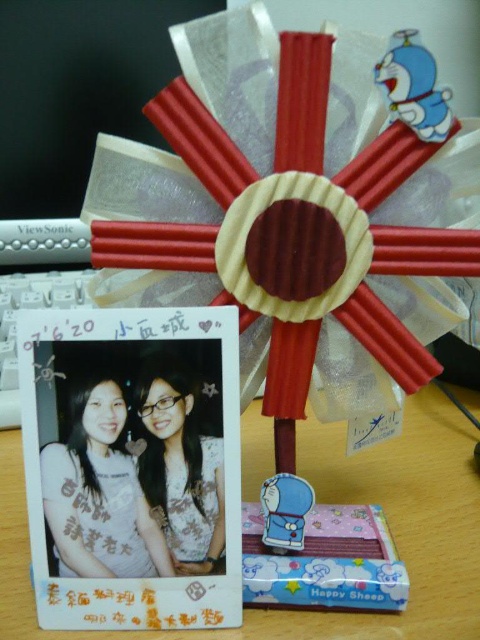
Question: Which point is closer to the camera taking this photo?

Choices:
 (A) (444, 496)
 (B) (123, 515)

Answer: (B)

Question: Does white glossy photo frame at center have a lesser width compared to matte photo frame at center?

Choices:
 (A) no
 (B) yes

Answer: (A)

Question: Is matte photo frame at center smaller than matte white blouse at center?

Choices:
 (A) no
 (B) yes

Answer: (A)

Question: Which of the following is the closest to the observer?

Choices:
 (A) white glossy photo frame at center
 (B) matte white blouse at center

Answer: (A)

Question: Does white glossy photo frame at center have a larger size compared to matte white blouse at center?

Choices:
 (A) yes
 (B) no

Answer: (A)

Question: Which is nearer to the white glossy photo frame at center?

Choices:
 (A) matte white blouse at center
 (B) matte photo frame at center

Answer: (B)